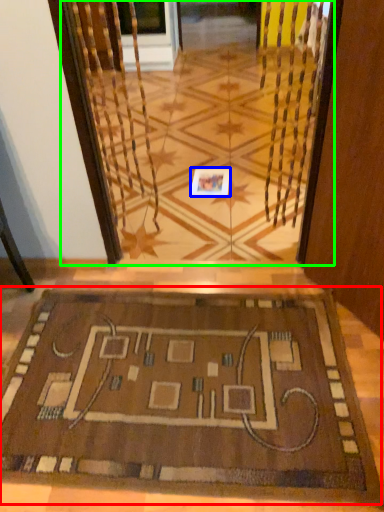
Question: Which object is the farthest from mat (highlighted by a red box)? Choose among these: square (highlighted by a blue box) or glass door (highlighted by a green box).

Choices:
 (A) square
 (B) glass door

Answer: (B)